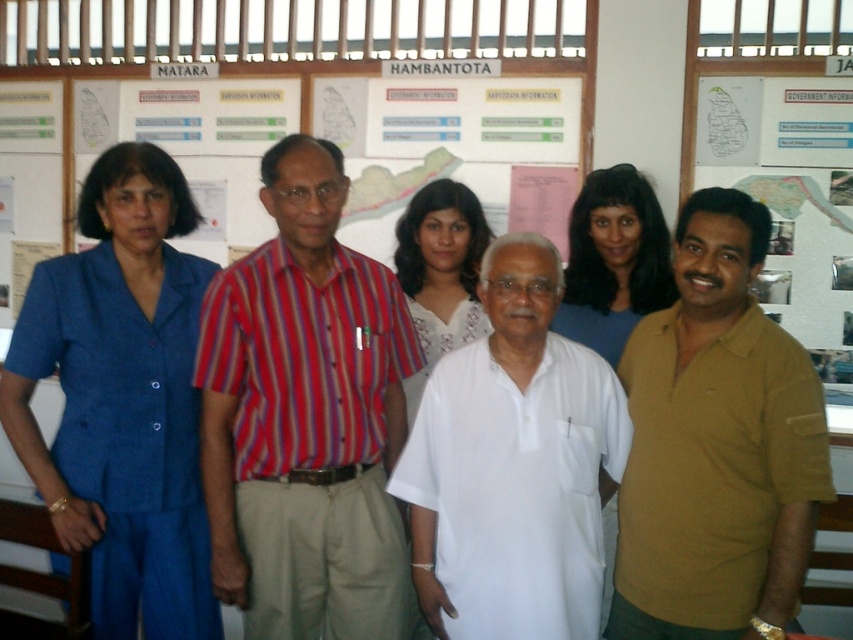
Question: Considering the real-world distances, which object is farthest from the blue fabric suit at left?

Choices:
 (A) matte blue dress at center
 (B) white lace dress at center
 (C) smooth blue blouse at center

Answer: (C)

Question: Which of the following is the closest to the observer?

Choices:
 (A) white cotton shirt at center
 (B) striped cotton shirt at center
 (C) smooth blue blouse at center

Answer: (A)

Question: Is matte yellow polo shirt at right to the right of white lace dress at center from the viewer's perspective?

Choices:
 (A) no
 (B) yes

Answer: (B)

Question: Does blue fabric suit at left come behind matte yellow polo shirt at right?

Choices:
 (A) yes
 (B) no

Answer: (A)

Question: Which of the following is the farthest from the observer?

Choices:
 (A) brown shirt at right
 (B) smooth blue blouse at center

Answer: (A)

Question: Does blue fabric suit at left have a smaller size compared to white cotton shirt at center?

Choices:
 (A) yes
 (B) no

Answer: (B)